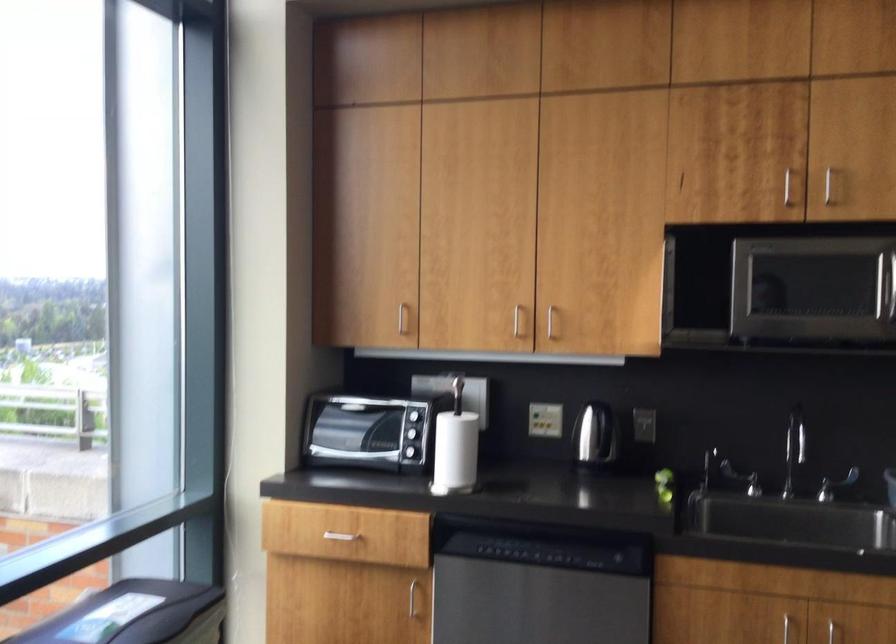
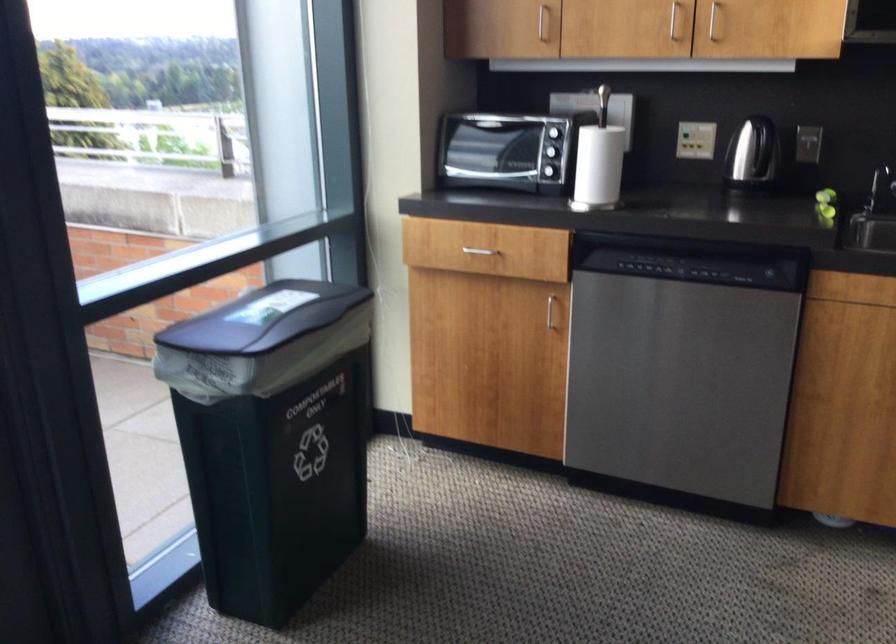
In the second image, find the point that corresponds to (548,426) in the first image.

(695, 140)